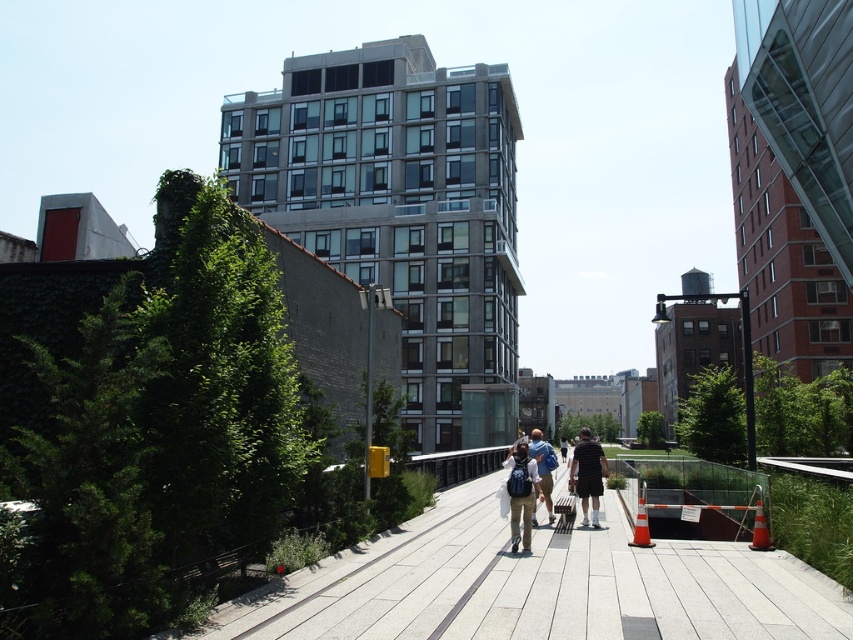
Is dark gray shorts at center to the right of matte blue backpack at center from the viewer's perspective?

Indeed, dark gray shorts at center is positioned on the right side of matte blue backpack at center.

Looking at this image, who is more forward, (576, 483) or (538, 456)?

Point (538, 456)

What do you see at coordinates (589, 474) in the screenshot?
I see `dark gray shorts at center` at bounding box center [589, 474].

Locate an element on the screen. Image resolution: width=853 pixels, height=640 pixels. dark gray shorts at center is located at coordinates (589, 474).

Is the position of white concrete pavement at center less distant than that of matte black backpack at center?

Yes, it is.

Describe the element at coordinates (537, 586) in the screenshot. I see `white concrete pavement at center` at that location.

I want to click on white concrete pavement at center, so click(537, 586).

Describe the element at coordinates (537, 586) in the screenshot. I see `white concrete pavement at center` at that location.

Who is more forward, (x=730, y=544) or (x=595, y=516)?

Point (x=730, y=544)

Where is `white concrete pavement at center`? This screenshot has width=853, height=640. white concrete pavement at center is located at coordinates (537, 586).